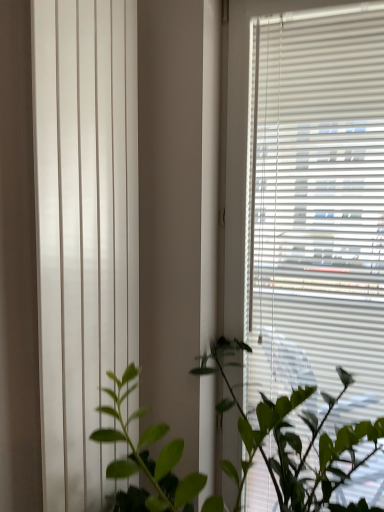
Question: Is white matte blinds at right inside or outside of white smooth vertical blinds at left?

Choices:
 (A) inside
 (B) outside

Answer: (B)

Question: Looking at the image, does white matte blinds at right seem bigger or smaller compared to white smooth vertical blinds at left?

Choices:
 (A) big
 (B) small

Answer: (A)

Question: Considering the real-world distances, which object is farthest from the white matte blinds at right?

Choices:
 (A) green leafy plant at center
 (B) white smooth vertical blinds at left

Answer: (B)

Question: Considering the real-world distances, which object is farthest from the white matte blinds at right?

Choices:
 (A) green leafy plant at center
 (B) white smooth vertical blinds at left

Answer: (B)